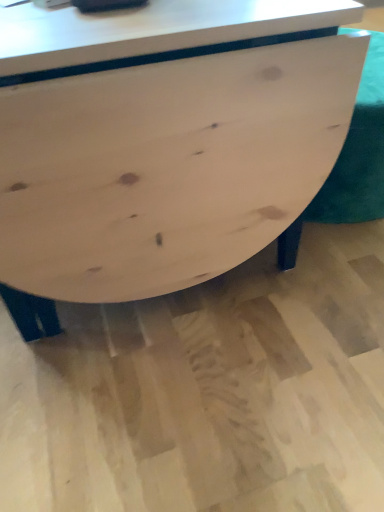
Question: From the image's perspective, is natural wood table at center above or below natural wood swivel chair at center?

Choices:
 (A) below
 (B) above

Answer: (A)

Question: From a real-world perspective, relative to natural wood swivel chair at center, is natural wood table at center vertically above or below?

Choices:
 (A) above
 (B) below

Answer: (A)

Question: Relative to natural wood swivel chair at center, is natural wood table at center in front or behind?

Choices:
 (A) behind
 (B) front

Answer: (B)

Question: From a real-world perspective, is natural wood swivel chair at center above or below natural wood table at center?

Choices:
 (A) above
 (B) below

Answer: (B)

Question: Considering their positions, is natural wood swivel chair at center located in front of or behind natural wood table at center?

Choices:
 (A) behind
 (B) front

Answer: (A)

Question: From the image's perspective, relative to natural wood table at center, is natural wood swivel chair at center above or below?

Choices:
 (A) above
 (B) below

Answer: (A)

Question: From their relative heights in the image, would you say natural wood swivel chair at center is taller or shorter than natural wood table at center?

Choices:
 (A) short
 (B) tall

Answer: (A)